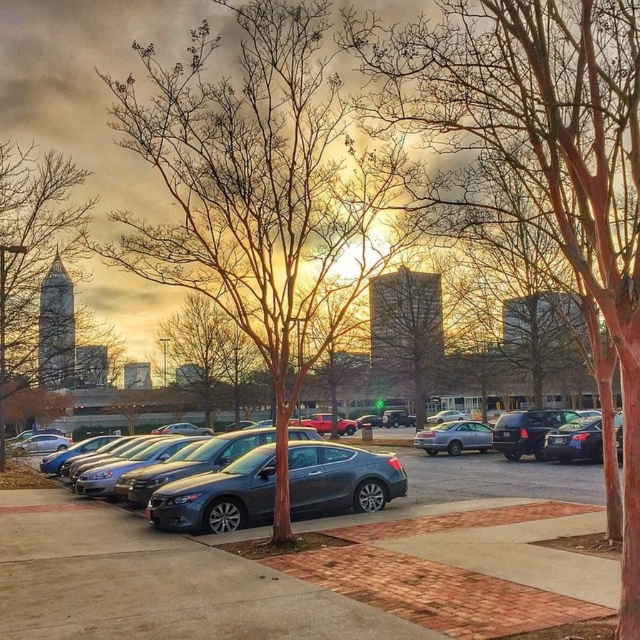
You are standing at the origin point of the image coordinate system. You want to walk to the metallic gray car at center. Which direction should you walk to reach it?

You should walk towards the point at coordinate 0.742 on the x axis and 0.767 on the y axis to reach the metallic gray car at center.

You are standing at the edge of the parking lot and want to walk to the gray concrete pavement at center. According to the coordinates provided, in which direction should you move relative to your current position?

The gray concrete pavement at center is located at coordinates point (154, 582), so you should move towards the center of the image to reach it.

You are a delivery person who needs to back out of the parking spot where you are currently parked. You see the satin gray sedan at center and the shiny black sedan at right. Which car is blocking your path when backing out?

The shiny black sedan at right is blocking your path because the satin gray sedan at center is positioned over it, meaning the shiny black sedan is behind the satin gray sedan.